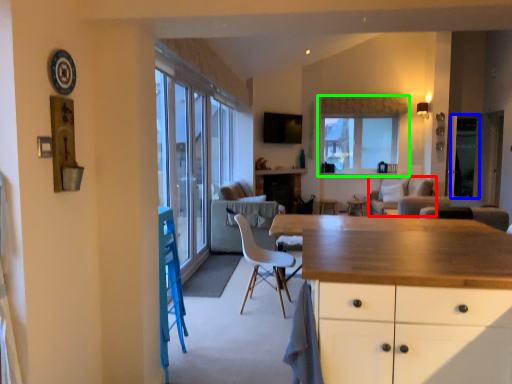
Question: Considering the real-world distances, which object is closest to couch (highlighted by a red box)? window screen (highlighted by a blue box) or window (highlighted by a green box).

Choices:
 (A) window screen
 (B) window

Answer: (A)